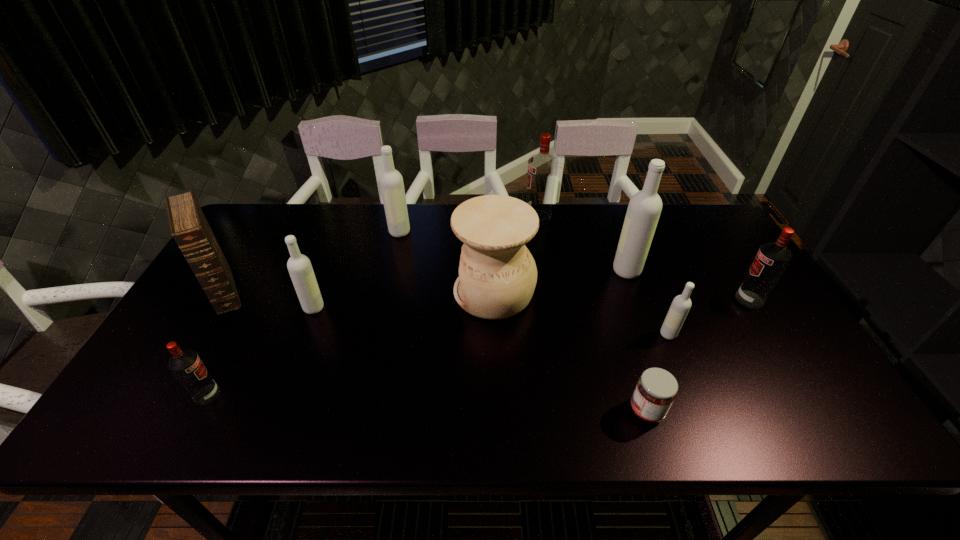
I want to click on red vodka that stands as the second closest to the third nearest object, so click(x=542, y=168).

Locate an element on the screen. red vodka that stands as the second closest to the red jam is located at coordinates (542, 168).

This screenshot has width=960, height=540. What are the coordinates of `free spot that satisfies the following two spatial constraints: 1. on the back side of the red jam; 2. on the right side of the third farthest vodka` in the screenshot? It's located at (604, 271).

At what (x,y) coordinates should I click in order to perform the action: click on vacant space that satisfies the following two spatial constraints: 1. on the front label of the leftmost red vodka; 2. on the left side of the shortest object. Please return your answer as a coordinate pair (x, y). The image size is (960, 540). Looking at the image, I should click on (199, 410).

At what (x,y) coordinates should I click in order to perform the action: click on blank space that satisfies the following two spatial constraints: 1. on the front label of the red jam; 2. on the right side of the leftmost vodka. Please return your answer as a coordinate pair (x, y). This screenshot has height=540, width=960. Looking at the image, I should click on (199, 410).